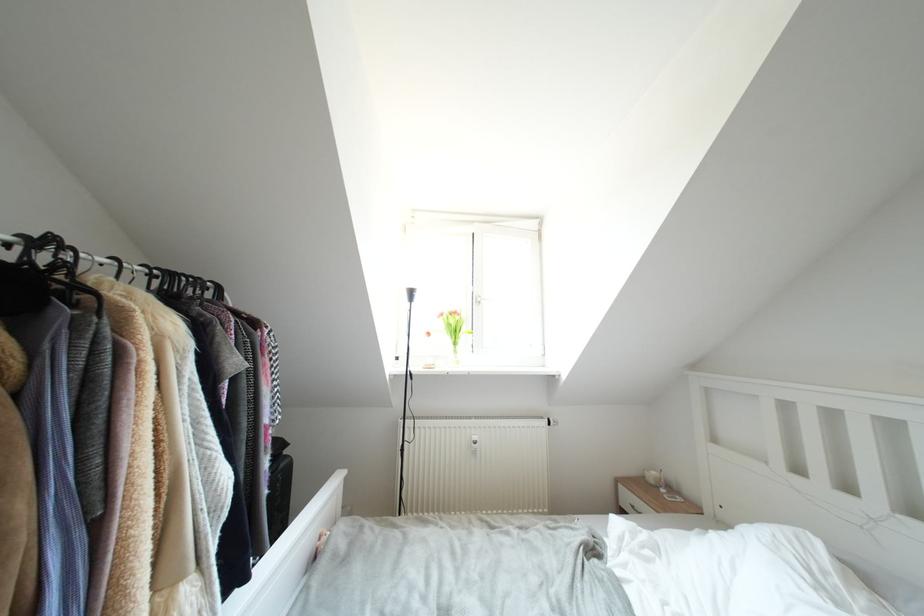
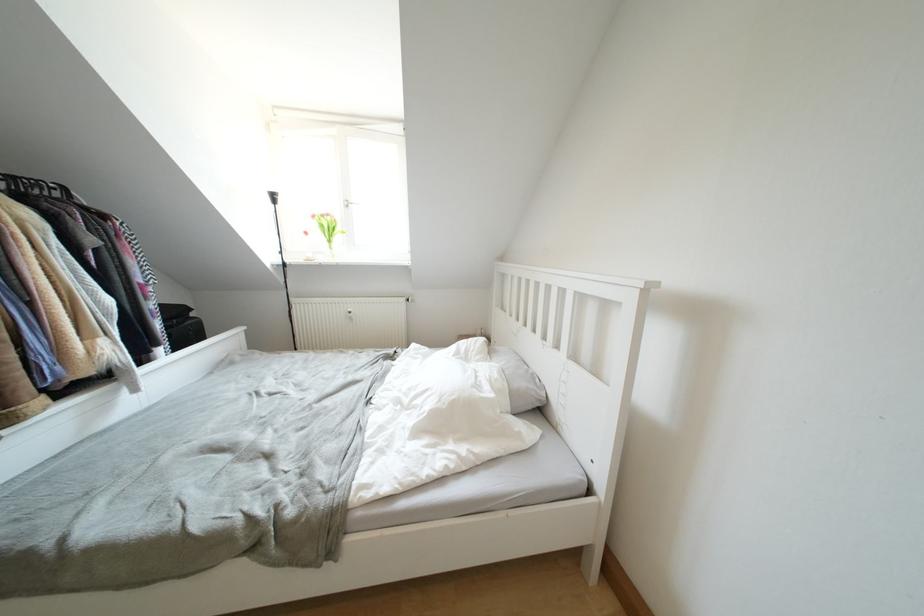
Locate, in the second image, the point that corresponds to point (447, 318) in the first image.

(319, 220)